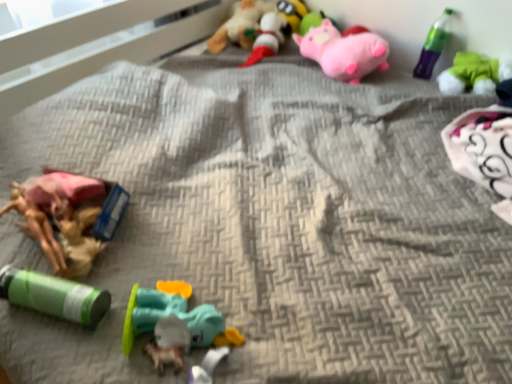
Question: Do you think translucent plastic toy at center, the 8th toy positioned from the top, is within soft plush toy at upper center, the 7th toy positioned from the bottom, or outside of it?

Choices:
 (A) outside
 (B) inside

Answer: (A)

Question: In terms of width, does translucent plastic toy at center, positioned as the first toy in bottom-to-top order, look wider or thinner when compared to soft plush toy at upper center, which is counted as the 2th toy, starting from the top?

Choices:
 (A) thin
 (B) wide

Answer: (A)

Question: Considering the real-world distances, which object is closest to the translucent plastic toy at center, the 8th toy positioned from the top?

Choices:
 (A) rubberized plastic toy at center, which is the 7th toy in top-to-bottom order
 (B) soft plush toy at upper center, which is counted as the 2th toy, starting from the top
 (C) pink plush toy at upper center, the first toy when ordered from top to bottom
 (D) green matte cylinder at lower left, positioned as the 5th toy in top-to-bottom order
 (E) green plastic bottle at upper right

Answer: (A)

Question: Which object is the closest to the green plush toy at upper right, placed as the 4th toy when sorted from top to bottom?

Choices:
 (A) pink plush pig at upper right, the 3th toy positioned from the top
 (B) green matte cylinder at lower left, positioned as the 5th toy in top-to-bottom order
 (C) green plastic bottle at upper right
 (D) teal rubber duck at center, the 6th toy when ordered from top to bottom
 (E) rubberized plastic toy at center, which appears as the 2th toy when ordered from the bottom

Answer: (C)